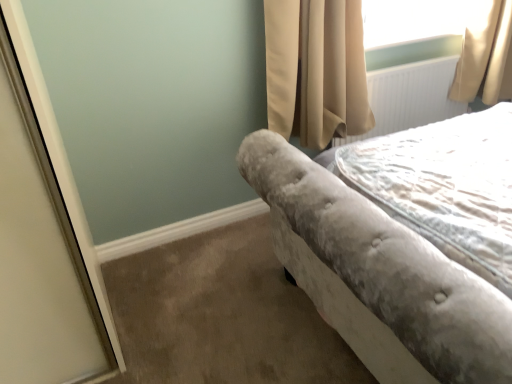
Describe the element at coordinates (409, 97) in the screenshot. I see `white textured radiator at upper right` at that location.

Measure the distance between white textured radiator at upper right and camera.

The depth of white textured radiator at upper right is 6.07 feet.

Image resolution: width=512 pixels, height=384 pixels. In order to click on velvet gray bed at right in this screenshot , I will do `click(377, 273)`.

Is velvet gray bed at right far from white textured radiator at upper right?

No, velvet gray bed at right is in close proximity to white textured radiator at upper right.

Would you say velvet gray bed at right is to the left or to the right of white textured radiator at upper right in the picture?

Based on their positions, velvet gray bed at right is located to the left of white textured radiator at upper right.

Which is more distant, (469, 348) or (385, 95)?

The point (385, 95) is behind.

Between velvet gray bed at right and white textured radiator at upper right, which one has more height?

velvet gray bed at right.

Based on their sizes in the image, would you say white textured radiator at upper right is bigger or smaller than velvet gray bed at right?

Considering their sizes, white textured radiator at upper right takes up less space than velvet gray bed at right.

Can you confirm if white textured radiator at upper right is thinner than velvet gray bed at right?

Yes.

Is white textured radiator at upper right inside or outside of velvet gray bed at right?

white textured radiator at upper right is not inside velvet gray bed at right, it's outside.

Could you tell me if white textured radiator at upper right is facing velvet gray bed at right?

Yes, white textured radiator at upper right faces towards velvet gray bed at right.

From the image's perspective, is velvet gray bed at right located above velvet gray bedspread at right?

Yes.

Between point (317, 174) and point (411, 151), which one is positioned behind?

The point (411, 151) is more distant.

Considering their positions, is velvet gray bed at right located in front of or behind velvet gray bedspread at right?

Clearly, velvet gray bed at right is in front of velvet gray bedspread at right.

The width and height of the screenshot is (512, 384). What are the coordinates of `sheet located behind the velvet gray bed at right` in the screenshot? It's located at (446, 186).

Is beige velvet curtain at upper right facing towards velvet gray bed at right?

Yes.

Considering the sizes of objects beige velvet curtain at upper right and velvet gray bed at right in the image provided, who is taller, beige velvet curtain at upper right or velvet gray bed at right?

Standing taller between the two is velvet gray bed at right.

Locate an element on the screen. The height and width of the screenshot is (384, 512). bed on the right of beige velvet curtain at upper right is located at coordinates (377, 273).

How far apart are beige velvet curtain at upper right and velvet gray bed at right?

The distance of beige velvet curtain at upper right from velvet gray bed at right is 25.95 inches.

Would you say velvet gray bedspread at right is outside velvet gray bed at right?

No, velvet gray bedspread at right is not outside of velvet gray bed at right.

Is velvet gray bedspread at right further to camera compared to velvet gray bed at right?

That is True.

How distant is velvet gray bedspread at right from velvet gray bed at right?

The distance of velvet gray bedspread at right from velvet gray bed at right is 11.43 inches.

From a real-world perspective, is velvet gray bedspread at right beneath velvet gray bed at right?

Indeed, from a real-world perspective, velvet gray bedspread at right is positioned beneath velvet gray bed at right.

In the scene shown: Is velvet gray bedspread at right positioned behind beige velvet curtain at upper right?

No, it is in front of beige velvet curtain at upper right.

Which is closer, (470, 177) or (303, 9)?

Point (470, 177).

From a real-world perspective, is velvet gray bedspread at right physically located above or below beige velvet curtain at upper right?

In terms of real-world spatial position, velvet gray bedspread at right is below beige velvet curtain at upper right.

From the image's perspective, is velvet gray bedspread at right located above or below beige velvet curtain at upper right?

Based on their image positions, velvet gray bedspread at right is located beneath beige velvet curtain at upper right.

From a real-world perspective, is white textured radiator at upper right positioned above or below velvet gray bedspread at right?

From a real-world perspective, white textured radiator at upper right is physically below velvet gray bedspread at right.

Considering the sizes of objects white textured radiator at upper right and velvet gray bedspread at right in the image provided, who is bigger, white textured radiator at upper right or velvet gray bedspread at right?

velvet gray bedspread at right.

I want to click on radiator above the velvet gray bedspread at right (from the image's perspective), so click(x=409, y=97).

Would you say white textured radiator at upper right is to the left or to the right of velvet gray bedspread at right in the picture?

white textured radiator at upper right is to the right of velvet gray bedspread at right.

Where is `radiator above the velvet gray bed at right (from the image's perspective)`? radiator above the velvet gray bed at right (from the image's perspective) is located at coordinates (409, 97).

At what (x,y) coordinates should I click in order to perform the action: click on radiator behind the velvet gray bed at right. Please return your answer as a coordinate pair (x, y). The width and height of the screenshot is (512, 384). Looking at the image, I should click on (409, 97).

Based on their spatial positions, is beige velvet curtain at upper right or white textured radiator at upper right closer to velvet gray bedspread at right?

beige velvet curtain at upper right lies closer to velvet gray bedspread at right than the other object.

Which object lies further to the anchor point white textured radiator at upper right, velvet gray bedspread at right or beige velvet curtain at upper right?

velvet gray bedspread at right is further to white textured radiator at upper right.

From the image, which object appears to be nearer to white textured radiator at upper right, velvet gray bed at right or velvet gray bedspread at right?

The object closer to white textured radiator at upper right is velvet gray bedspread at right.

When comparing their distances from velvet gray bedspread at right, does velvet gray bed at right or beige velvet curtain at upper right seem closer?

velvet gray bed at right lies closer to velvet gray bedspread at right than the other object.

Estimate the real-world distances between objects in this image. Which object is further from velvet gray bedspread at right, white textured radiator at upper right or beige velvet curtain at upper right?

white textured radiator at upper right is further to velvet gray bedspread at right.

Looking at the image, which one is located further to beige velvet curtain at upper right, white textured radiator at upper right or velvet gray bed at right?

A: velvet gray bed at right is further to beige velvet curtain at upper right.

From the image, which object appears to be farther from velvet gray bedspread at right, velvet gray bed at right or white textured radiator at upper right?

white textured radiator at upper right is positioned further to the anchor velvet gray bedspread at right.

Which object lies nearer to the anchor point velvet gray bedspread at right, beige velvet curtain at upper right or velvet gray bed at right?

velvet gray bed at right is closer to velvet gray bedspread at right.

Locate an element on the screen. This screenshot has width=512, height=384. curtain positioned between velvet gray bedspread at right and white textured radiator at upper right from near to far is located at coordinates (316, 69).

The image size is (512, 384). In order to click on sheet between velvet gray bed at right and white textured radiator at upper right from front to back in this screenshot , I will do `click(446, 186)`.

Locate an element on the screen. The width and height of the screenshot is (512, 384). sheet located between velvet gray bed at right and beige velvet curtain at upper right in the depth direction is located at coordinates (446, 186).

Find the location of a particular element. This screenshot has width=512, height=384. curtain located between velvet gray bed at right and white textured radiator at upper right in the depth direction is located at coordinates (316, 69).